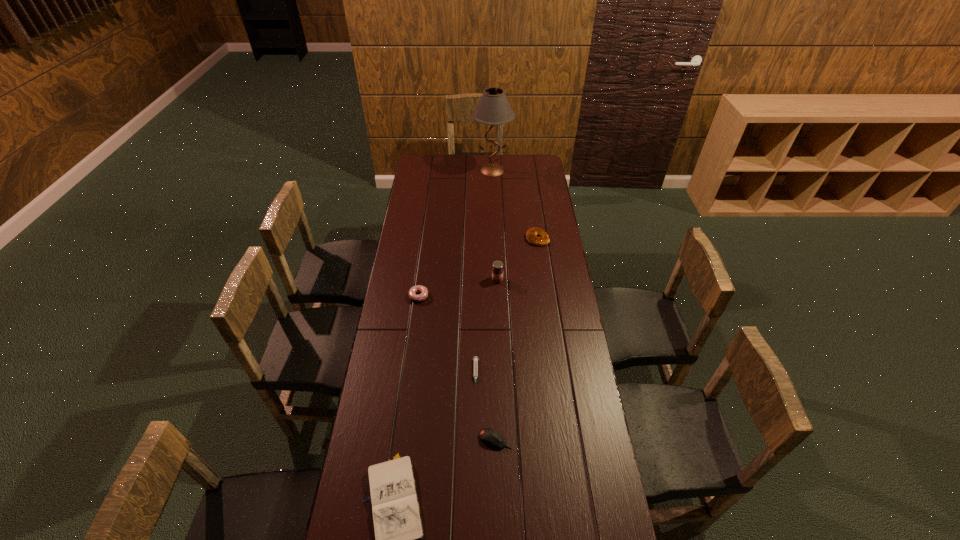
This screenshot has width=960, height=540. In order to click on object that stands as the third closest to the bagel in this screenshot , I will do `click(423, 290)`.